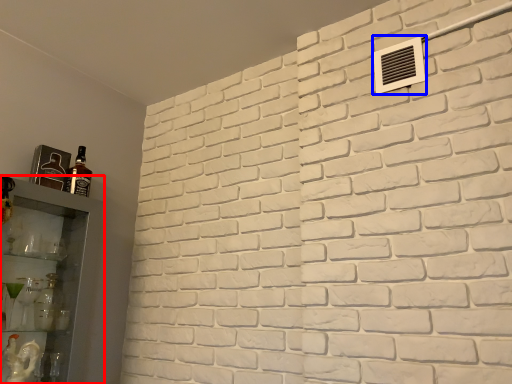
Question: Which object appears closest to the camera in this image, shelf (highlighted by a red box) or air conditioning (highlighted by a blue box)?

Choices:
 (A) shelf
 (B) air conditioning

Answer: (A)